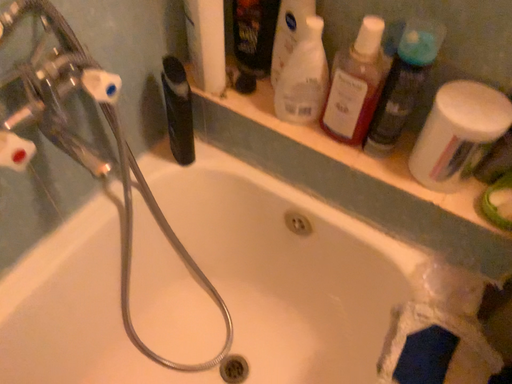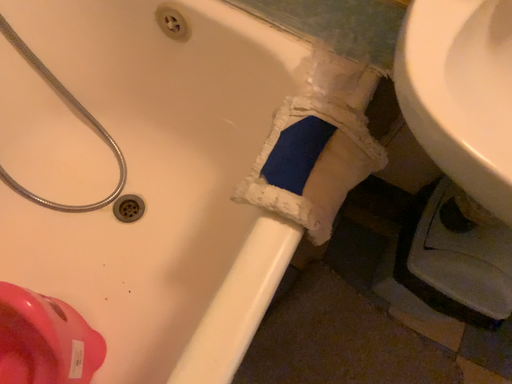
Question: Which way did the camera rotate in the video?

Choices:
 (A) rotated downward
 (B) rotated upward

Answer: (A)